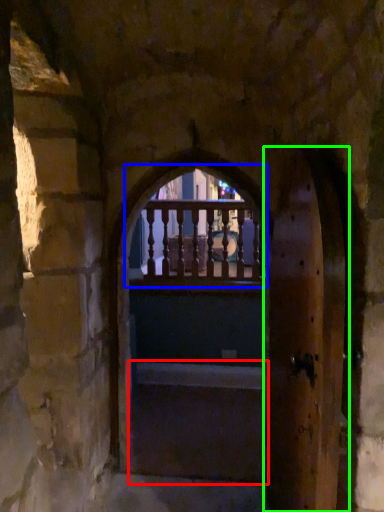
Question: Estimate the real-world distances between objects in this image. Which object is farther from stairs (highlighted by a red box), glass window (highlighted by a blue box) or screen door (highlighted by a green box)?

Choices:
 (A) glass window
 (B) screen door

Answer: (B)